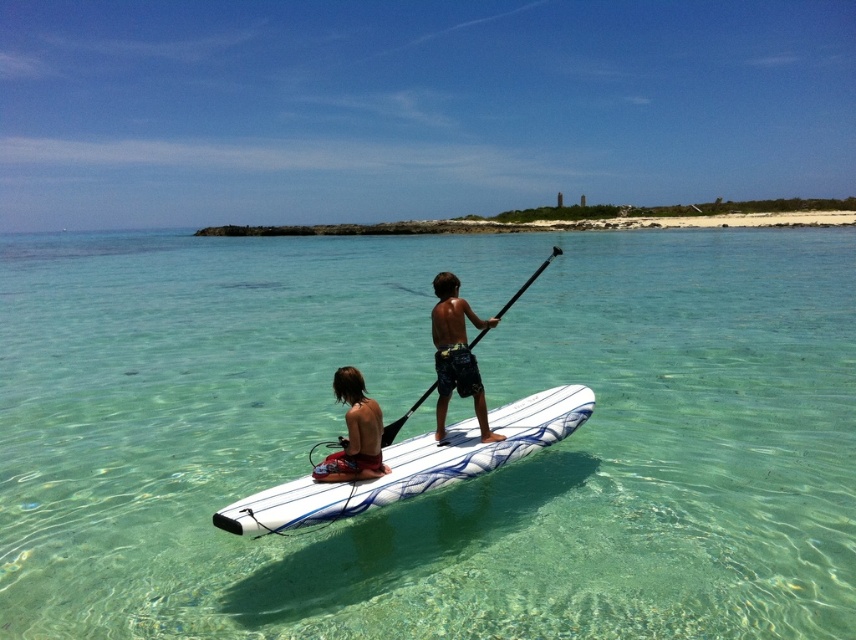
You are a photographer trying to capture the perfect shot of the dark blue board shorts at center and the black matte paddle at center. Based on their sizes, which object should you focus on to ensure it fits entirely within your camera frame?

The dark blue board shorts at center has a lesser width compared to the black matte paddle at center, so you should focus on the black matte paddle at center to ensure it fits entirely within your camera frame since it is wider.